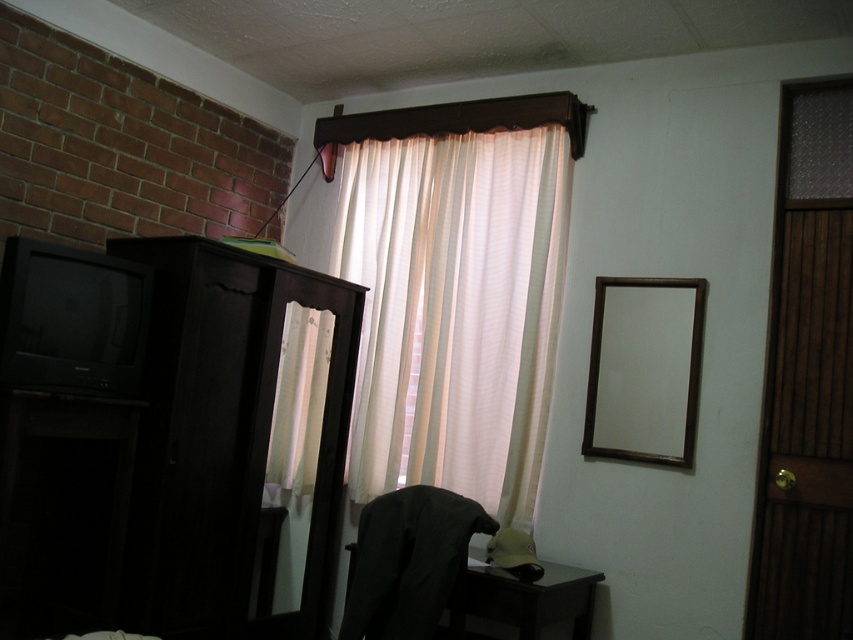
Can you confirm if dark wood dresser at left is positioned below white sheer curtain at upper center?

Yes, dark wood dresser at left is below white sheer curtain at upper center.

In order to click on dark wood dresser at left in this screenshot , I will do `click(155, 436)`.

Can you confirm if dark wood dresser at left is bigger than dark fabric chair at lower center?

Yes, dark wood dresser at left is bigger than dark fabric chair at lower center.

Locate an element on the screen. This screenshot has height=640, width=853. dark wood dresser at left is located at coordinates (155, 436).

Is wooden frame mirror at upper right wider than dark fabric chair at lower center?

No, wooden frame mirror at upper right is not wider than dark fabric chair at lower center.

Does point (688, 339) come behind point (459, 600)?

Yes, it is.

Identify the location of wooden frame mirror at upper right. (643, 369).